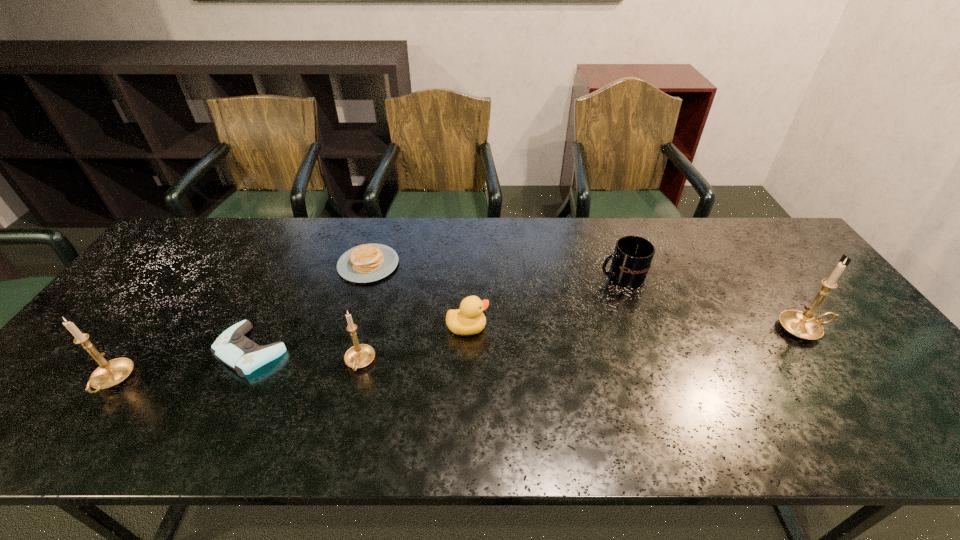
This screenshot has width=960, height=540. Identify the location of the third closest candle holder to the pancake. (803, 325).

Point out which candle holder is positioned as the nearest to the mug. Please provide its 2D coordinates. Your answer should be formatted as a tuple, i.e. [(x, y)], where the tuple contains the x and y coordinates of a point satisfying the conditions above.

[(803, 325)]

The image size is (960, 540). Find the location of `free space that satisfies the following two spatial constraints: 1. on the handle side of the farthest candle holder; 2. on the handle side of the second shortest candle holder`. free space that satisfies the following two spatial constraints: 1. on the handle side of the farthest candle holder; 2. on the handle side of the second shortest candle holder is located at coordinates (841, 381).

The width and height of the screenshot is (960, 540). I want to click on vacant space that satisfies the following two spatial constraints: 1. at the beak of the duck; 2. on the handle side of the fifth shortest object, so click(467, 363).